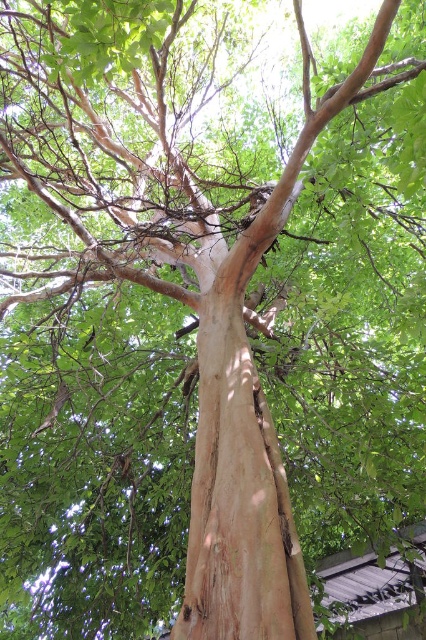
Question: Which point is farther to the camera?

Choices:
 (A) light brown rough bark at center
 (B) smooth bark branch at center

Answer: (B)

Question: Which of the following is the farthest from the observer?

Choices:
 (A) light brown rough bark at center
 (B) smooth bark branch at center

Answer: (B)

Question: Can you confirm if smooth bark branch at center is bigger than light brown rough bark at center?

Choices:
 (A) yes
 (B) no

Answer: (A)

Question: Considering the relative positions of smooth bark branch at center and light brown rough bark at center in the image provided, where is smooth bark branch at center located with respect to light brown rough bark at center?

Choices:
 (A) above
 (B) below

Answer: (A)

Question: Is smooth bark branch at center above light brown rough bark at center?

Choices:
 (A) no
 (B) yes

Answer: (B)

Question: Which object appears closest to the camera in this image?

Choices:
 (A) light brown rough bark at center
 (B) smooth bark branch at center

Answer: (A)